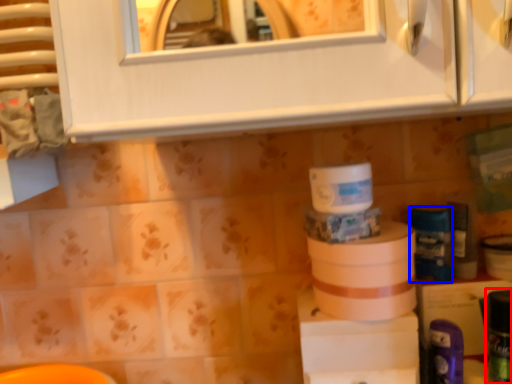
Question: Which point is closer to the camera, toiletry (highlighted by a red box) or toiletry (highlighted by a blue box)?

Choices:
 (A) toiletry
 (B) toiletry

Answer: (A)